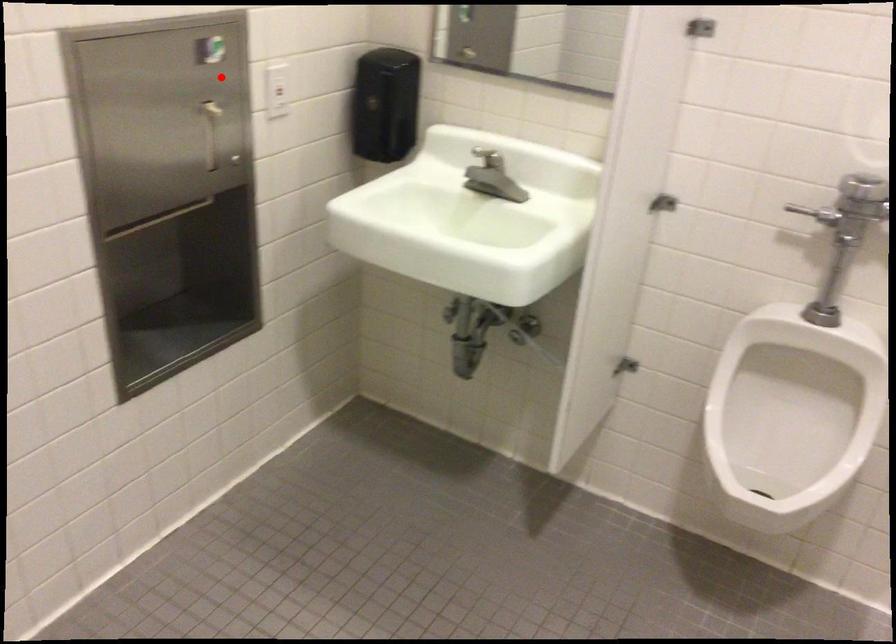
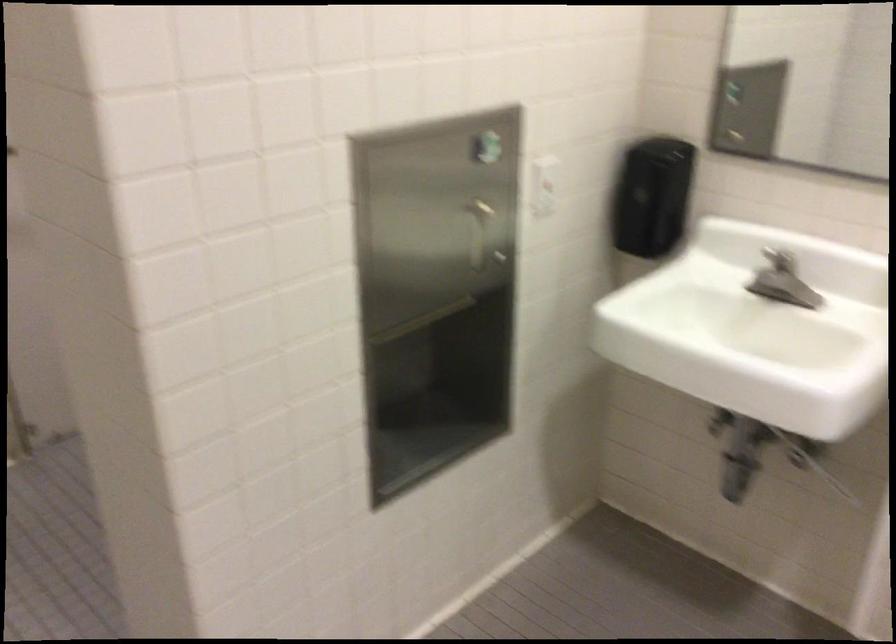
In the second image, find the point that corresponds to the highlighted location in the first image.

(493, 175)